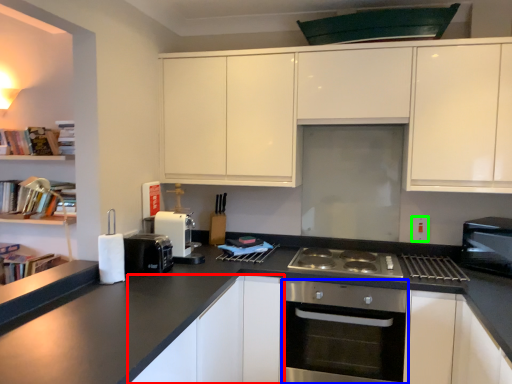
Question: Which is farther away from cabinetry (highlighted by a red box)? oven (highlighted by a blue box) or electric outlet (highlighted by a green box)?

Choices:
 (A) oven
 (B) electric outlet

Answer: (B)